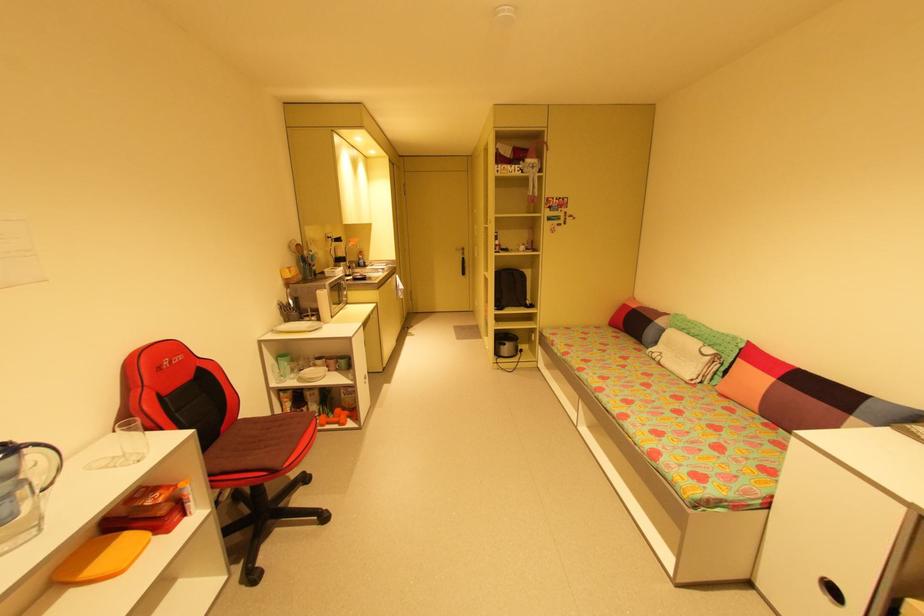
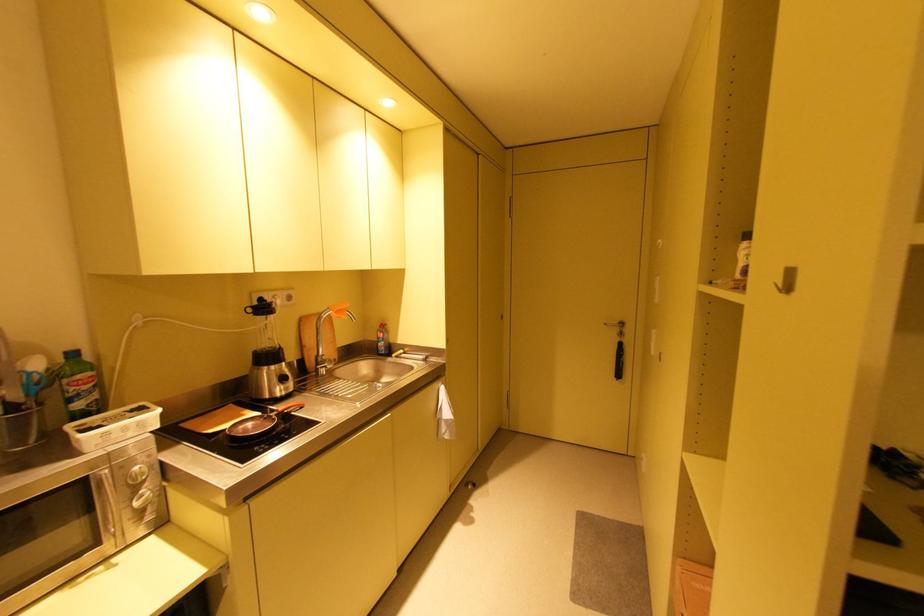
Question: Which direction would the cameraman need to move to produce the second image? Reply with the corresponding letter.

Choices:
 (A) Left
 (B) Right
 (C) Forward
 (D) Backward

Answer: (C)